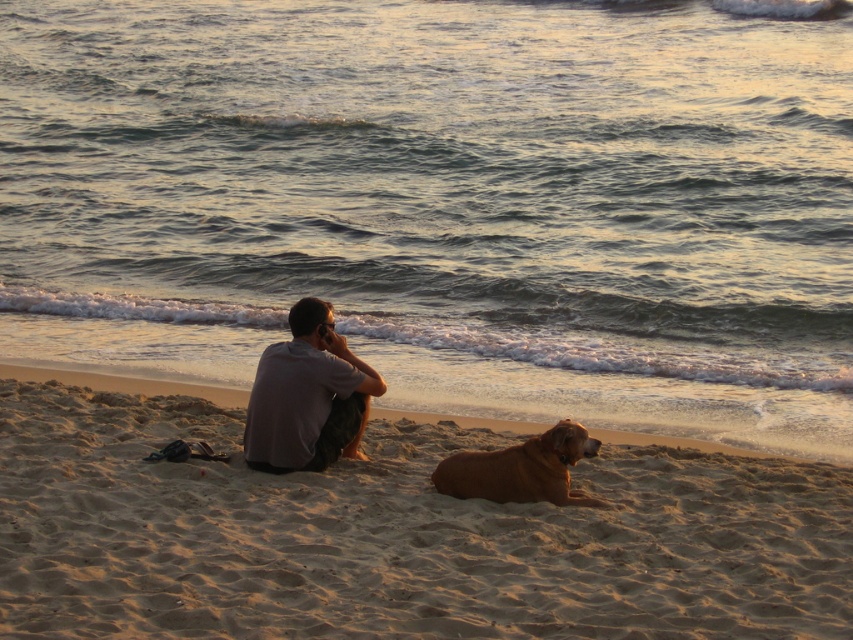
From the picture: You are standing on the beach and see the sandy shore at lower center and the golden fur dog at lower center. Which object is located to the left when viewed from your perspective?

The sandy shore at lower center is positioned on the left side of the golden fur dog at lower center, so from your perspective, the sandy shore at lower center is to the left.